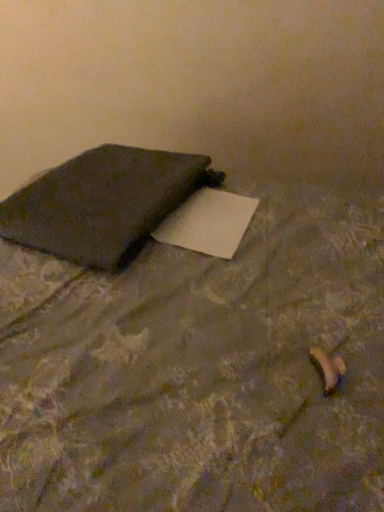
Question: Would you say matte black notebook at left contains matte black pillow at upper left?

Choices:
 (A) no
 (B) yes

Answer: (A)

Question: Is matte black notebook at left oriented away from matte black pillow at upper left?

Choices:
 (A) no
 (B) yes

Answer: (B)

Question: Is matte black notebook at left located outside matte black pillow at upper left?

Choices:
 (A) no
 (B) yes

Answer: (A)

Question: Can you confirm if matte black notebook at left is thinner than matte black pillow at upper left?

Choices:
 (A) yes
 (B) no

Answer: (A)

Question: From a real-world perspective, is matte black notebook at left positioned under matte black pillow at upper left based on gravity?

Choices:
 (A) yes
 (B) no

Answer: (B)

Question: From a real-world perspective, is matte black notebook at left located higher than matte black pillow at upper left?

Choices:
 (A) no
 (B) yes

Answer: (B)

Question: From a real-world perspective, is matte black pillow at upper left physically above matte black notebook at left?

Choices:
 (A) yes
 (B) no

Answer: (B)

Question: From the image's perspective, is matte black pillow at upper left located beneath matte black notebook at left?

Choices:
 (A) no
 (B) yes

Answer: (B)

Question: Can you confirm if matte black pillow at upper left is taller than matte black notebook at left?

Choices:
 (A) yes
 (B) no

Answer: (A)

Question: Does matte black pillow at upper left lie behind matte black notebook at left?

Choices:
 (A) no
 (B) yes

Answer: (A)

Question: Is matte black pillow at upper left wider than matte black notebook at left?

Choices:
 (A) yes
 (B) no

Answer: (A)

Question: From a real-world perspective, is matte black pillow at upper left under matte black notebook at left?

Choices:
 (A) no
 (B) yes

Answer: (B)

Question: In terms of width, does matte black notebook at left look wider or thinner when compared to matte black pillow at upper left?

Choices:
 (A) thin
 (B) wide

Answer: (A)